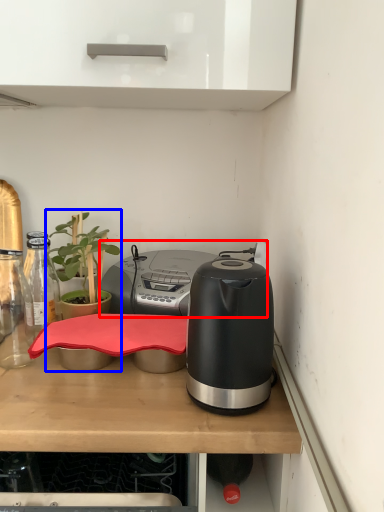
Question: Which point is closer to the camera, appliance (highlighted by a red box) or houseplant (highlighted by a blue box)?

Choices:
 (A) appliance
 (B) houseplant

Answer: (B)